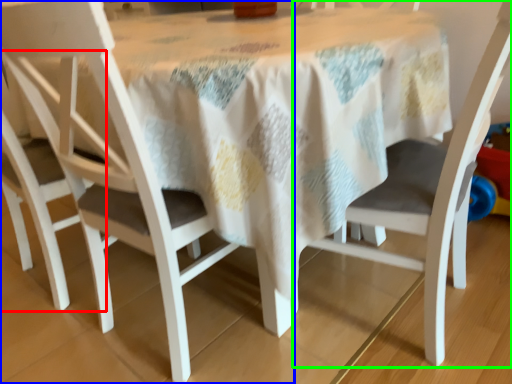
Question: Considering the real-world distances, which object is farthest from chair (highlighted by a red box)? chair (highlighted by a blue box) or chair (highlighted by a green box)?

Choices:
 (A) chair
 (B) chair

Answer: (B)